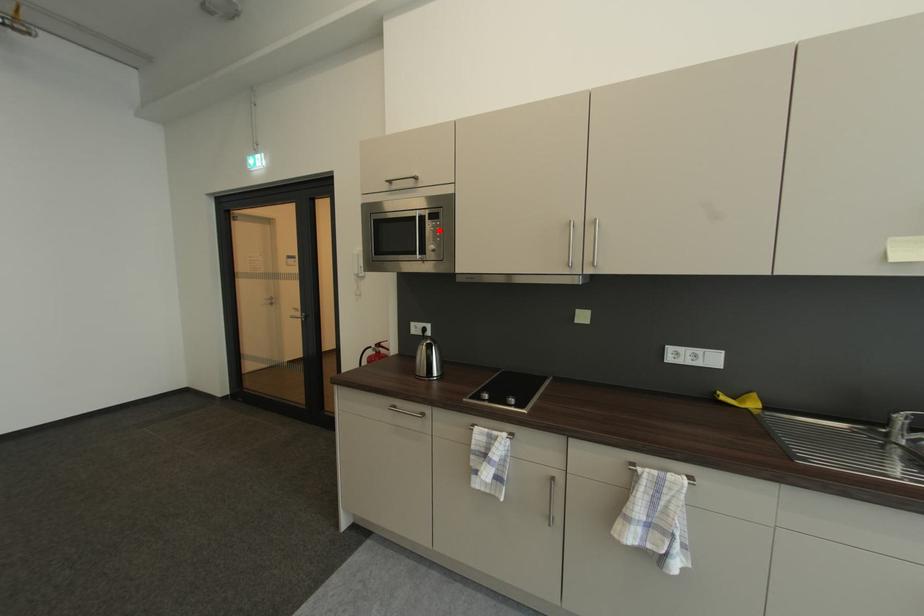
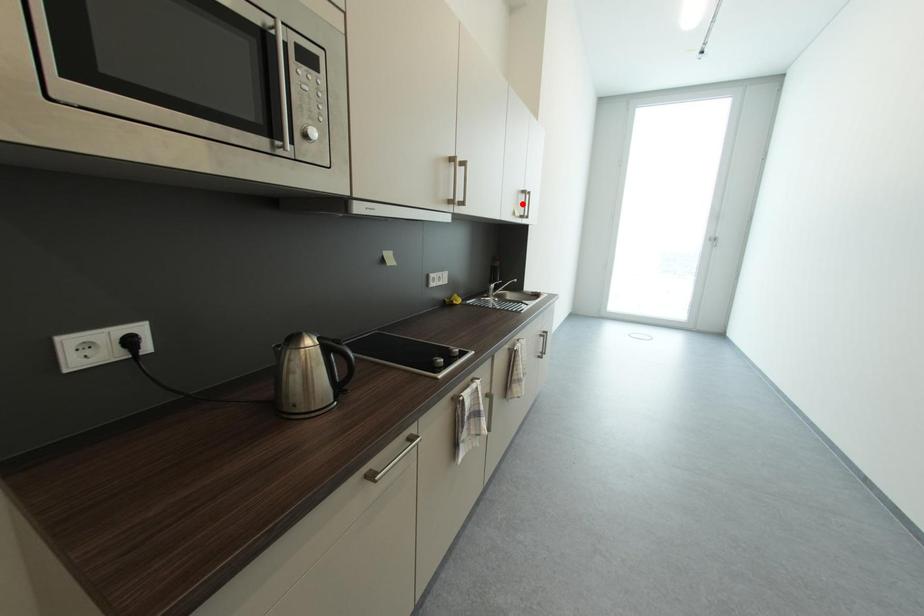
I am providing you with two images of the same scene from different viewpoints. A red point is marked on the first image and another point is marked on the second image. Does the point marked in image1 correspond to the same location as the one in image2?

No